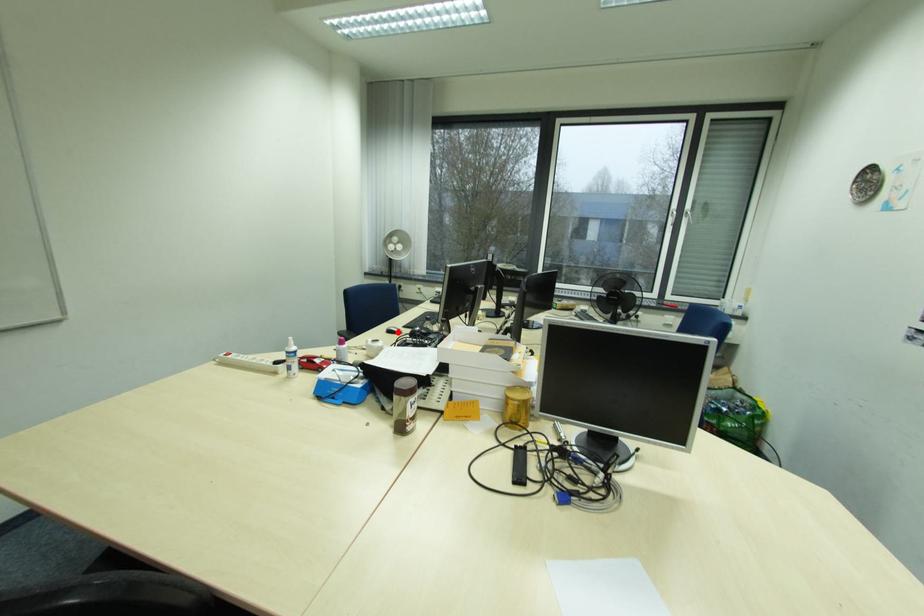
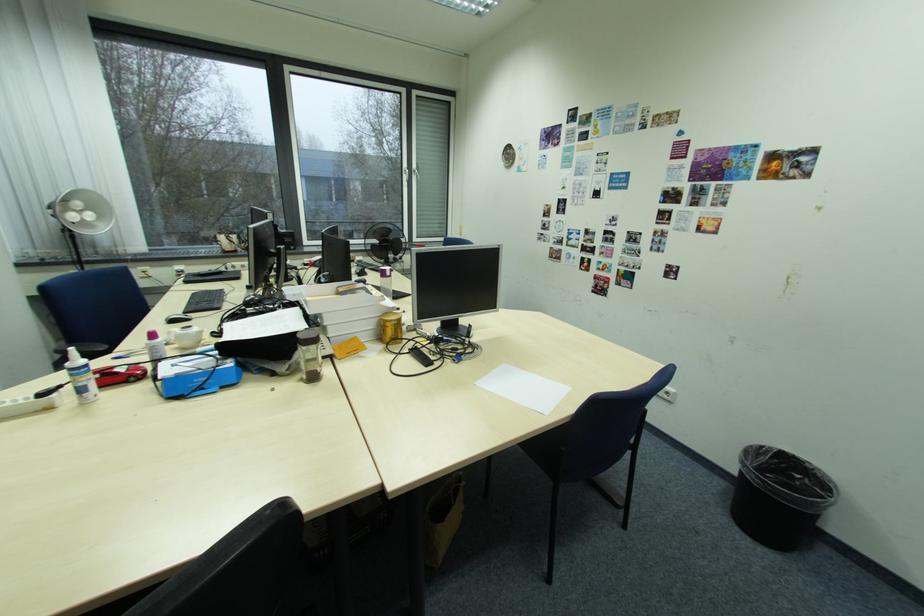
Find the pixel in the second image that matches the highlighted location in the first image.

(180, 322)